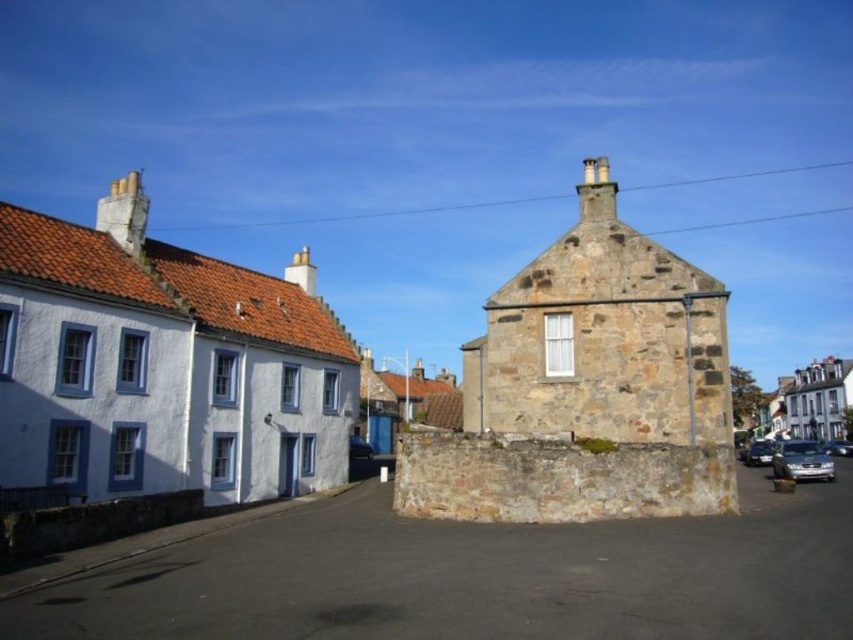
Does stone chimney at upper center appear under smooth stone chimney at center?

Correct, stone chimney at upper center is located below smooth stone chimney at center.

What do you see at coordinates (596, 189) in the screenshot? Image resolution: width=853 pixels, height=640 pixels. I see `stone chimney at upper center` at bounding box center [596, 189].

Does point (608, 212) lie behind point (306, 284)?

No, it is not.

At what (x,y) coordinates should I click in order to perform the action: click on stone chimney at upper center. Please return your answer as a coordinate pair (x, y). This screenshot has width=853, height=640. Looking at the image, I should click on (596, 189).

Who is positioned more to the left, stone chimney at upper center or metallic silver car at center?

metallic silver car at center

Can you confirm if stone chimney at upper center is positioned to the left of metallic silver car at center?

Incorrect, stone chimney at upper center is not on the left side of metallic silver car at center.

Between point (598, 180) and point (352, 456), which one is positioned behind?

The point (352, 456) is behind.

Identify the location of stone chimney at upper center. The width and height of the screenshot is (853, 640). (596, 189).

Between brown stone chimney at upper left and metallic silver car at center, which one has less height?

Standing shorter between the two is metallic silver car at center.

Is point (119, 198) more distant than point (355, 435)?

No, (119, 198) is in front of (355, 435).

Locate an element on the screen. brown stone chimney at upper left is located at coordinates (125, 212).